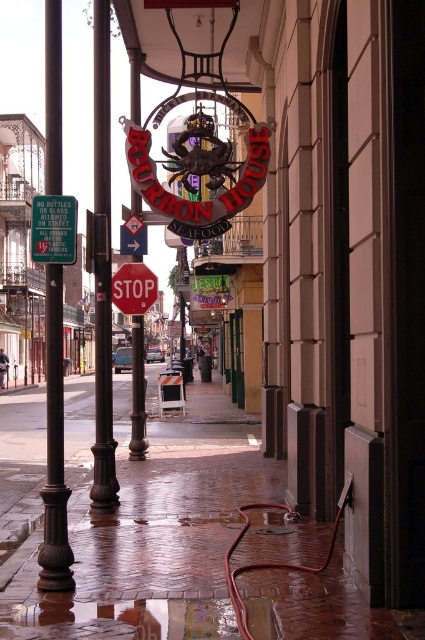
You are a delivery person trying to park your bike between the dark brown polished metal pole at left and the green plastic sign at left. Can you fit your bike there if the bike is 1.2 meters wide?

The dark brown polished metal pole at left might be wider than the green plastic sign at left, so the space between them may not be sufficient for a 1.2 meter wide bike. You should check the actual width before attempting to park.

You are a tourist standing on the wet, reflective brick sidewalk in front of the Bourbon House. You see the dark brown polished metal pole at left and the green plastic sign at left. Which object is closer to you?

The dark brown polished metal pole at left is closer to you because it is further to the viewer than the green plastic sign at left.

You are a pedestrian standing on the wet sidewalk in front of the Bourbon House. You need to walk to the red glossy stop sign at center. Will you pass by the black metal pole at left on your way there?

Yes, you will pass by the black metal pole at left on your way to the red glossy stop sign at center because the black metal pole at left is closer to the viewer than the red glossy stop sign at center.